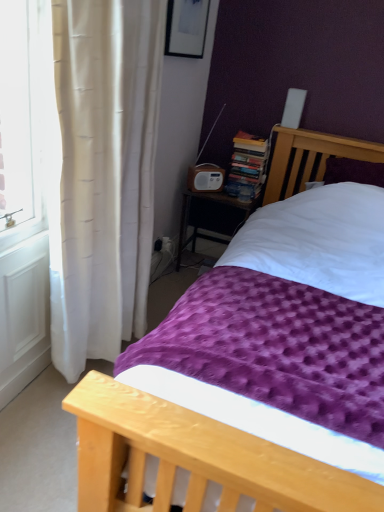
Question: Looking at the image, does purple textured blanket at center seem bigger or smaller compared to hardcover books at center?

Choices:
 (A) big
 (B) small

Answer: (A)

Question: In terms of width, does purple textured blanket at center look wider or thinner when compared to hardcover books at center?

Choices:
 (A) wide
 (B) thin

Answer: (A)

Question: Which object is the closest to the wooden radio at center?

Choices:
 (A) hardcover books at center
 (B) matte black picture frame at upper center
 (C) purple textured blanket at center
 (D) white plastic radio at center

Answer: (D)

Question: Based on their relative distances, which object is farther from the purple textured blanket at center?

Choices:
 (A) white plastic radio at center
 (B) hardcover books at center
 (C) matte black picture frame at upper center
 (D) wooden radio at center

Answer: (C)